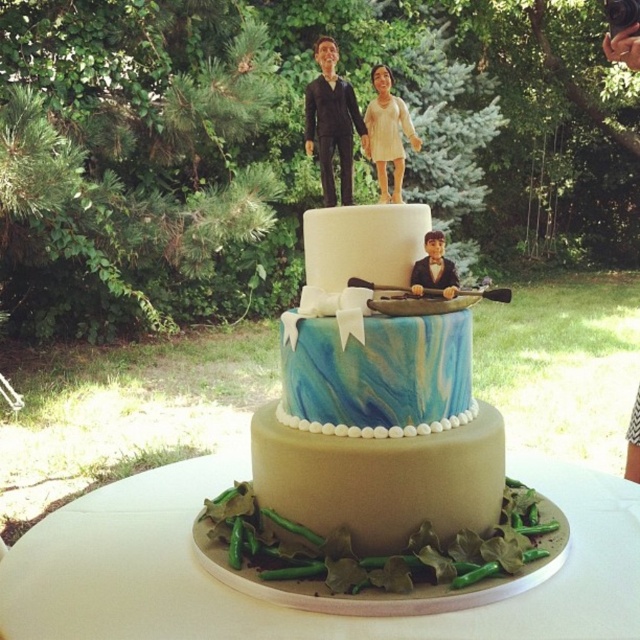
Based on the photo, is beige fondant cake at center to the left of smooth matte figurines at upper center from the viewer's perspective?

No, beige fondant cake at center is not to the left of smooth matte figurines at upper center.

In the scene shown: Is beige fondant cake at center shorter than smooth matte figurines at upper center?

Correct, beige fondant cake at center is not as tall as smooth matte figurines at upper center.

In the scene shown: Measure the distance between point (380, 628) and camera.

Point (380, 628) is 24.89 inches from camera.

Locate an element on the screen. beige fondant cake at center is located at coordinates (289, 609).

Is point (406, 352) positioned after point (426, 268)?

No.

Describe the element at coordinates (378, 448) in the screenshot. This screenshot has height=640, width=640. I see `marble blue cake at center` at that location.

Locate an element on the screen. marble blue cake at center is located at coordinates (378, 448).

Based on the photo, is beige fondant cake at center closer to camera compared to smooth beige figurine at upper center?

Yes, beige fondant cake at center is in front of smooth beige figurine at upper center.

Is point (593, 518) less distant than point (385, 164)?

That is True.

The image size is (640, 640). Find the location of `beige fondant cake at center`. beige fondant cake at center is located at coordinates (289, 609).